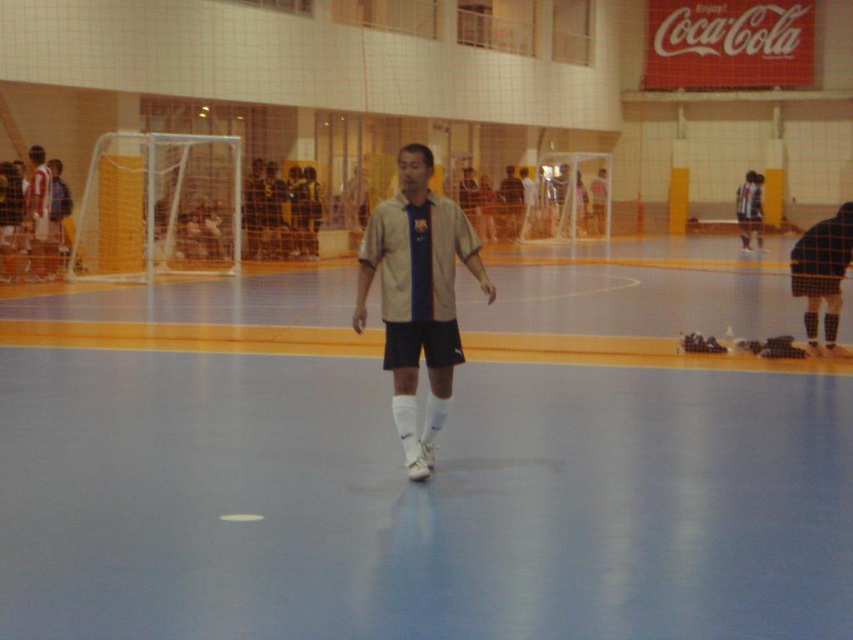
You are a photographer positioned at the back of the indoor sports facility. You need to capture a photo where both the matte white jersey at left and the matte beige shirt at center are clearly visible. Since the goalpost is in the background, which of the two should you focus on to ensure both are in focus?

The matte white jersey at left is shorter than the matte beige shirt at center, so focusing on the matte beige shirt at center will ensure both are in focus because it is farther away and the depth of field will include the closer, shorter matte white jersey at left.

You are a referee in the sports hall. You see the beige fabric shirt at center and the dark blue checkered shorts at right. Which clothing item is positioned lower in the image?

The beige fabric shirt at center is below the dark blue checkered shorts at right, so the beige fabric shirt at center is positioned lower in the image.